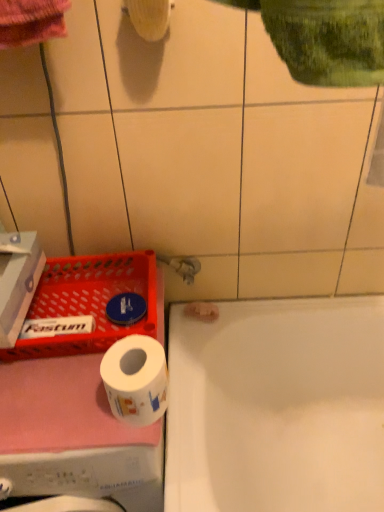
The width and height of the screenshot is (384, 512). I want to click on vacant space in front of white cardboard box at left, so click(43, 398).